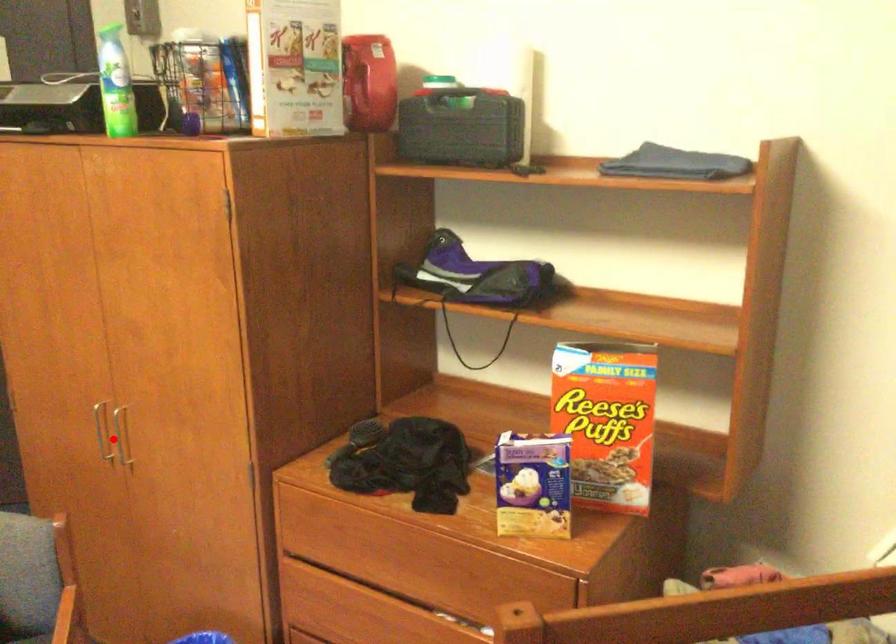
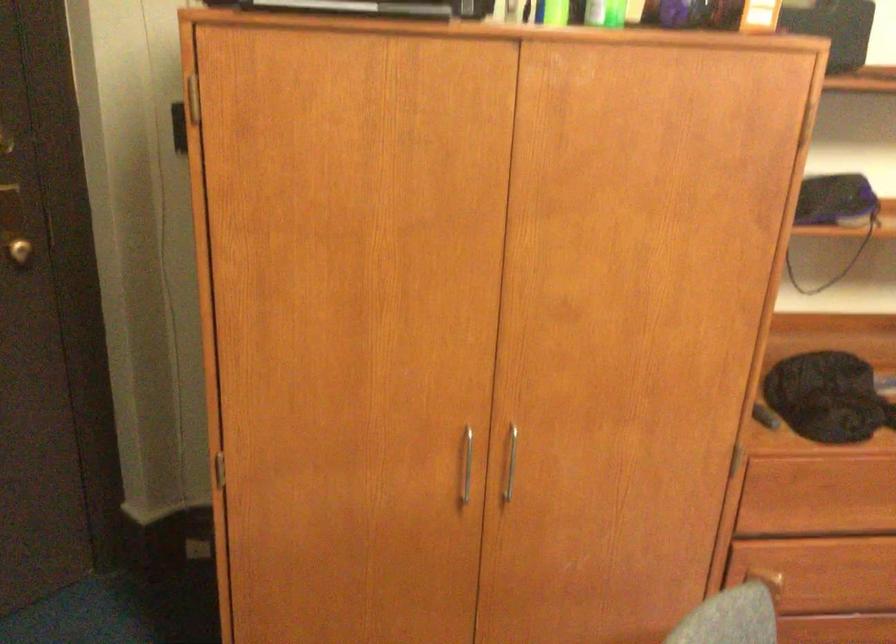
Question: I am providing you with two images of the same scene from different viewpoints. Image1 has a red point marked. In image2, the corresponding 3D location appears at what relative position? Reply with the corresponding letter.

Choices:
 (A) Closer
 (B) Farther

Answer: (A)